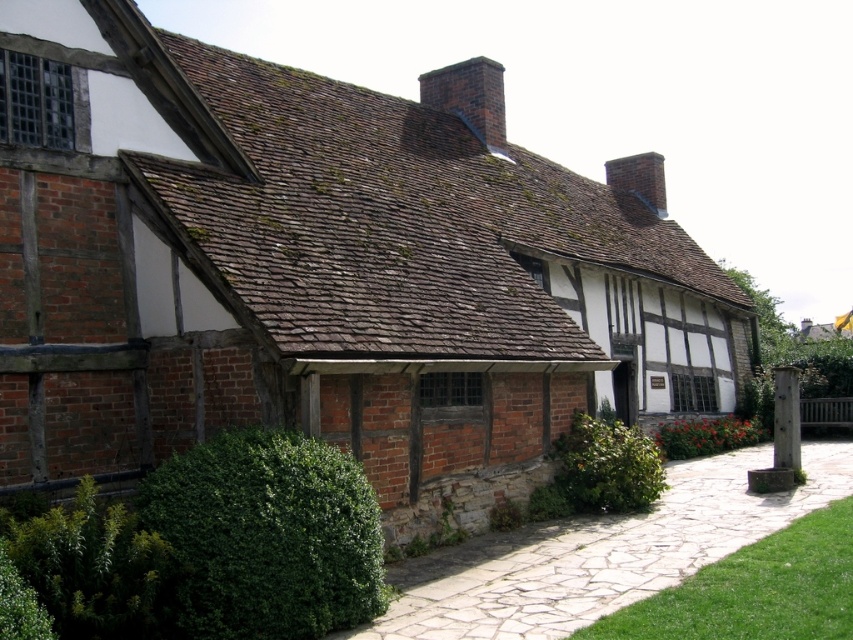
Image resolution: width=853 pixels, height=640 pixels. What do you see at coordinates (91, 566) in the screenshot? I see `green leafy hedge at lower left` at bounding box center [91, 566].

Can you confirm if green leafy hedge at lower left is positioned to the left of green leafy hedge at center?

Indeed, green leafy hedge at lower left is positioned on the left side of green leafy hedge at center.

Identify the location of green leafy hedge at lower left. Image resolution: width=853 pixels, height=640 pixels. (91, 566).

Locate an element on the screen. The width and height of the screenshot is (853, 640). green leafy hedge at lower left is located at coordinates (91, 566).

Between point (201, 563) and point (622, 451), which one is positioned in front?

Point (201, 563)

What do you see at coordinates (265, 538) in the screenshot? This screenshot has width=853, height=640. I see `dark green leafy hedge at lower left` at bounding box center [265, 538].

In order to click on dark green leafy hedge at lower left in this screenshot , I will do `click(265, 538)`.

The width and height of the screenshot is (853, 640). What do you see at coordinates (265, 538) in the screenshot? I see `dark green leafy hedge at lower left` at bounding box center [265, 538].

Between dark green leafy hedge at lower left and green leafy hedge at lower left, which one appears on the right side from the viewer's perspective?

dark green leafy hedge at lower left

Is point (316, 502) closer to camera compared to point (115, 531)?

No, (316, 502) is further to viewer.

The image size is (853, 640). I want to click on dark green leafy hedge at lower left, so coord(265,538).